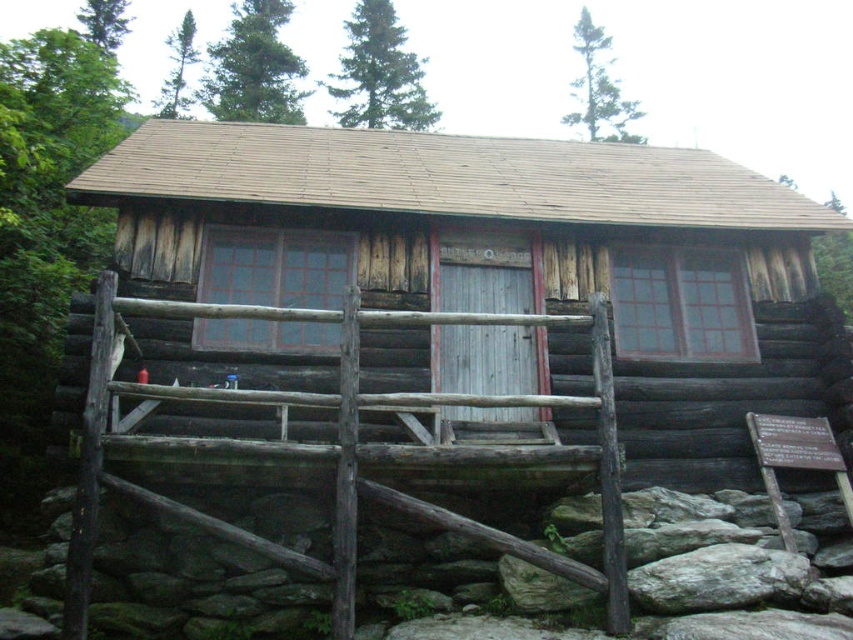
Question: Which point is farther to the camera?

Choices:
 (A) green coniferous tree at upper center
 (B) green leafy tree at upper right
 (C) green textured pine tree at upper center

Answer: (C)

Question: Is green textured pine tree at upper center below green needle-like tree at upper left?

Choices:
 (A) no
 (B) yes

Answer: (A)

Question: Which object is closer to the camera taking this photo?

Choices:
 (A) green textured pine tree at upper center
 (B) green coniferous tree at upper center

Answer: (B)

Question: Which object appears closest to the camera in this image?

Choices:
 (A) green needle-like leaves at upper center
 (B) green coniferous tree at upper center

Answer: (A)

Question: Does green needle-like leaves at upper center appear on the right side of green leafy tree at upper right?

Choices:
 (A) no
 (B) yes

Answer: (A)

Question: Can you confirm if green coniferous tree at upper center is positioned above green textured pine tree at upper center?

Choices:
 (A) yes
 (B) no

Answer: (A)